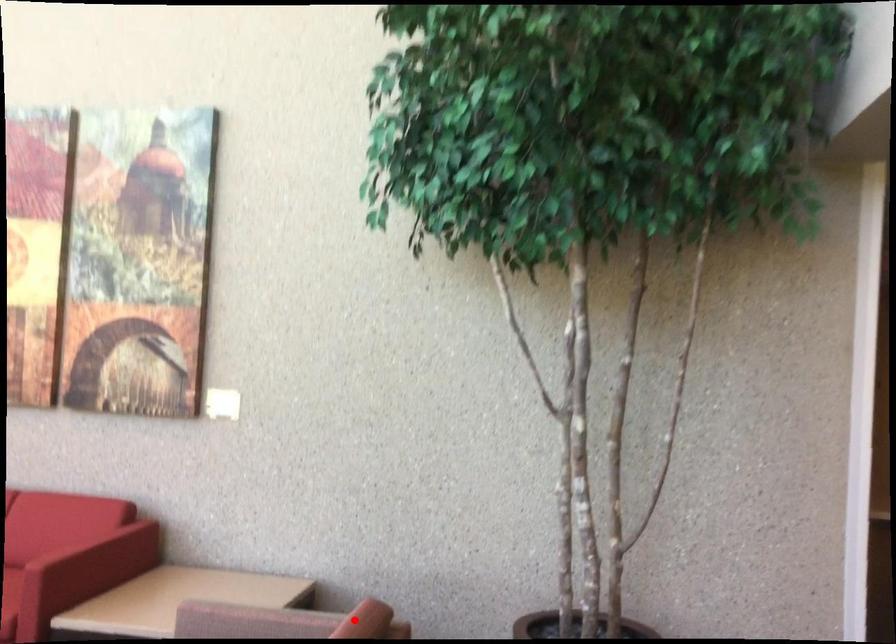
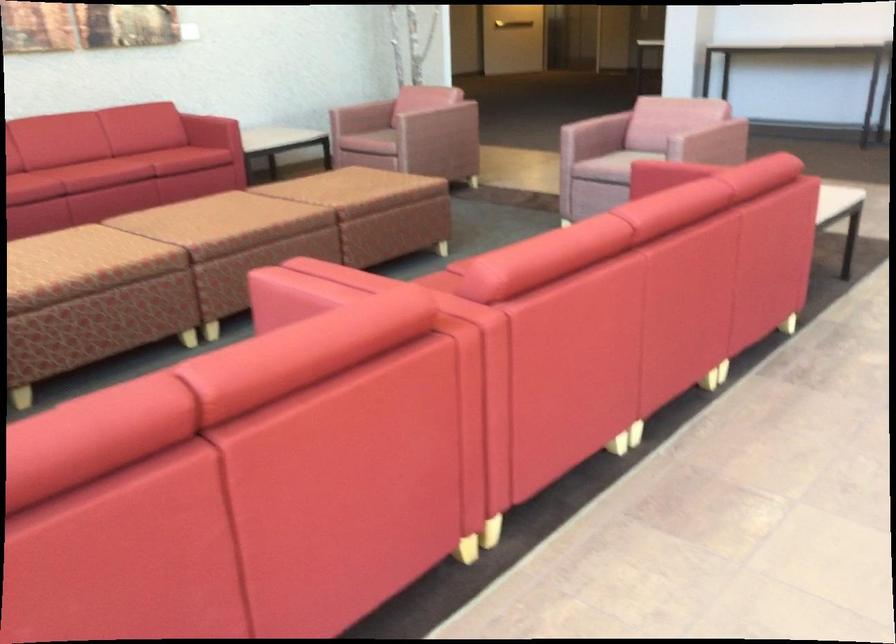
Question: I am providing you with two images of the same scene from different viewpoints. A red point is marked on the first image. Is the red point's position out of view in image 2?

Choices:
 (A) Yes
 (B) No

Answer: (B)